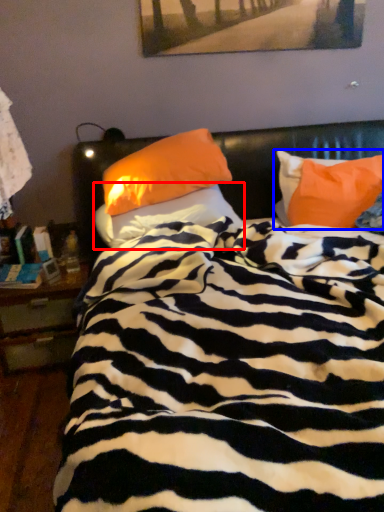
Question: Which point is closer to the camera, pillow (highlighted by a red box) or pillow (highlighted by a blue box)?

Choices:
 (A) pillow
 (B) pillow

Answer: (A)